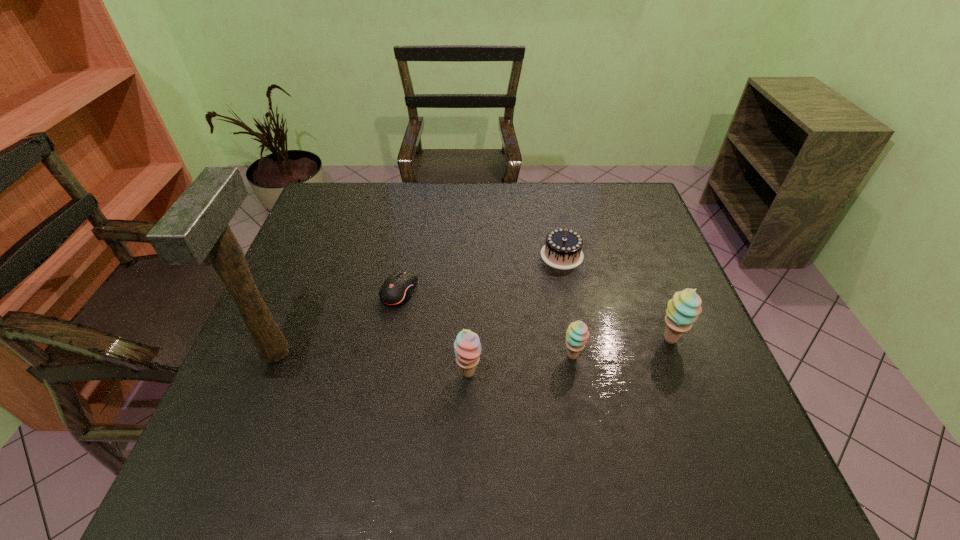
Identify the location of the leftmost object. The height and width of the screenshot is (540, 960). (196, 225).

What are the coordinates of `vacant area situated on the left of the fourth object from right to left` in the screenshot? It's located at (405, 374).

Where is `blank space located on the back of the shortest sherbert`? The image size is (960, 540). blank space located on the back of the shortest sherbert is located at coordinates (561, 292).

This screenshot has height=540, width=960. Identify the location of vacant space located on the left of the rightmost object. (511, 340).

Locate an element on the screen. The width and height of the screenshot is (960, 540). vacant space situated on the right of the computer mouse is located at coordinates (521, 291).

Where is `vacant space located on the right of the fifth tallest object`? This screenshot has width=960, height=540. vacant space located on the right of the fifth tallest object is located at coordinates (612, 255).

This screenshot has width=960, height=540. In order to click on vacant area situated 0.350m on the right of the mallet in this screenshot , I will do `click(443, 353)`.

I want to click on object that is at the left edge, so click(x=196, y=225).

Image resolution: width=960 pixels, height=540 pixels. In order to click on object positioned at the right edge in this screenshot , I will do `click(682, 311)`.

Where is `vacant space at the far edge of the desktop`? The height and width of the screenshot is (540, 960). vacant space at the far edge of the desktop is located at coordinates (471, 201).